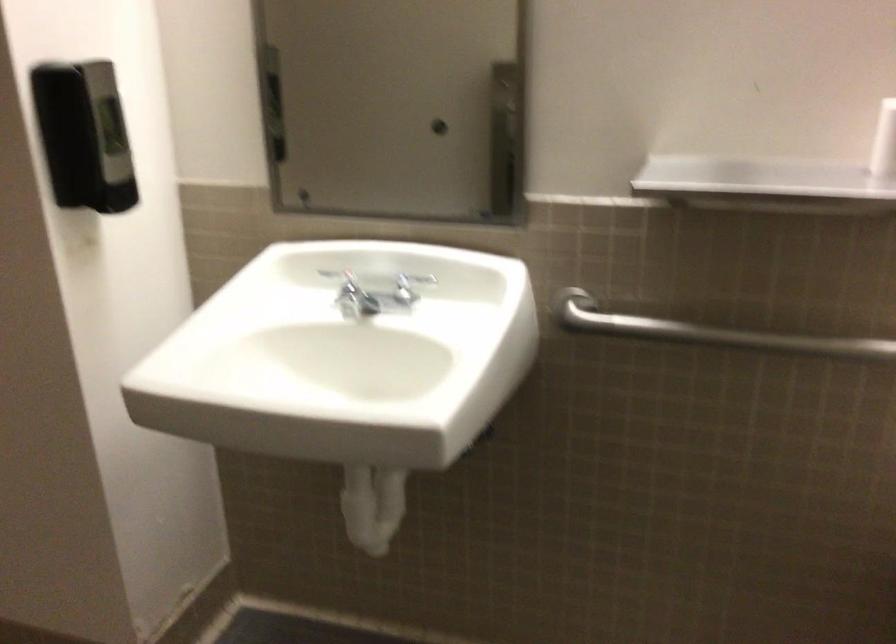
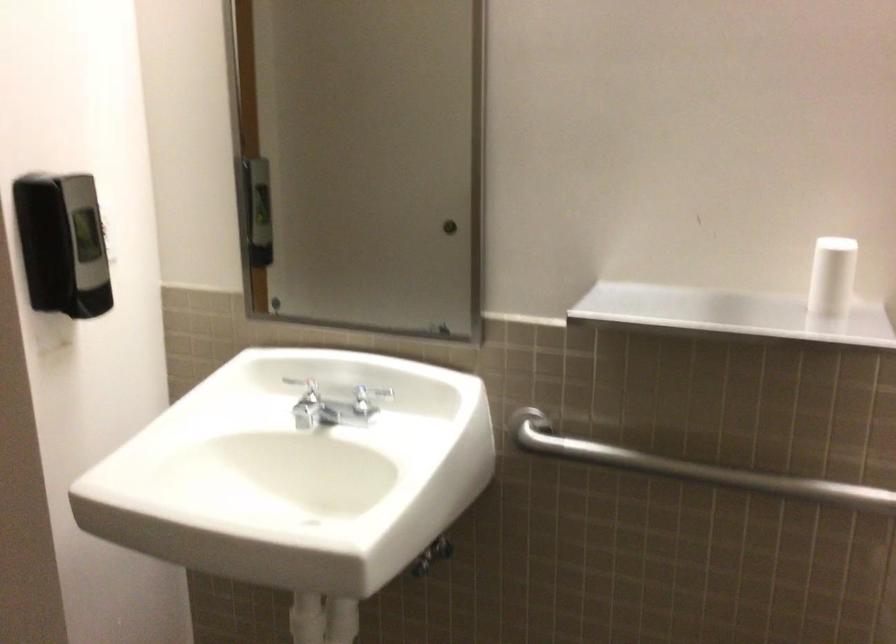
The point at (375,507) is marked in the first image. Where is the corresponding point in the second image?

(325, 623)